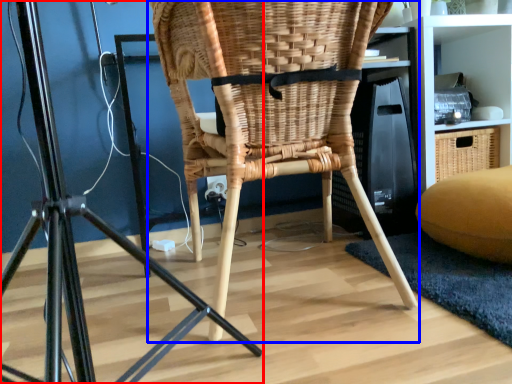
Question: Among these objects, which one is farthest to the camera, furniture (highlighted by a red box) or chair (highlighted by a blue box)?

Choices:
 (A) furniture
 (B) chair

Answer: (B)